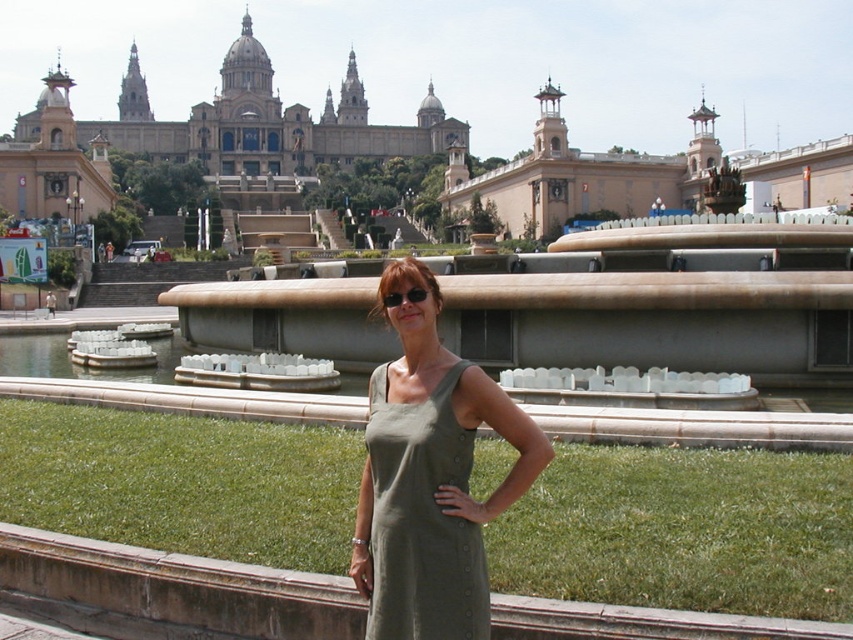
You are a photographer trying to capture a photo of the olive green fabric dress at center and the smooth beige wall at center in the scene. Which object is shorter in height?

The olive green fabric dress at center is not as tall as the smooth beige wall at center, so the olive green fabric dress at center is shorter in height.

In the scene shown: Based on the scene description, which object takes up more area in the image? Please choose between the green grass at center and the beige stone palace at upper center.

The beige stone palace at upper center occupies more space than the green grass at center according to the description.